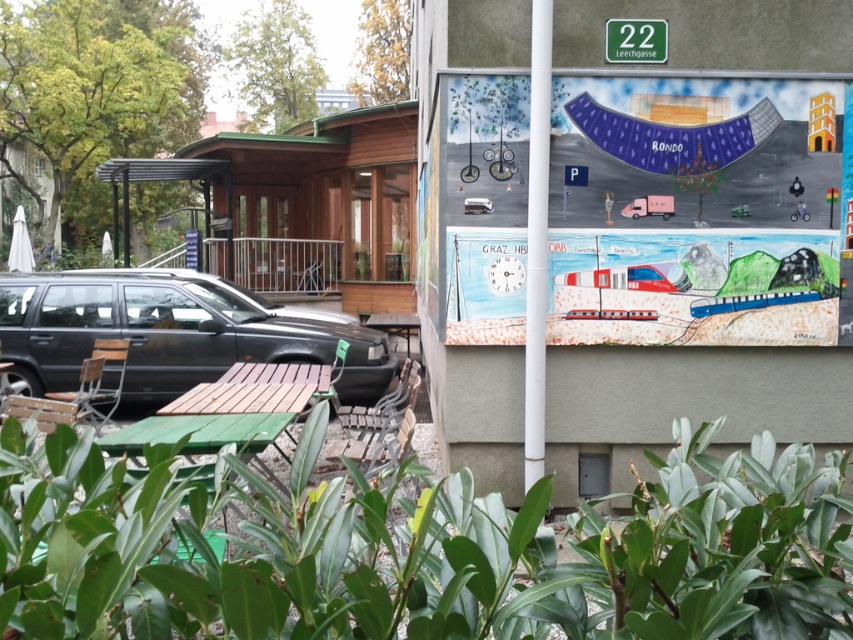
Question: Which point is farther to the camera?

Choices:
 (A) (366, 426)
 (B) (80, 301)
 (C) (462, 310)
 (D) (276, 422)

Answer: (B)

Question: Among these objects, which one is farthest from the camera?

Choices:
 (A) watercolor painting of train at upper right
 (B) green plastic street sign at upper center
 (C) matte black car at lower left
 (D) green wooden picnic table at lower left

Answer: (C)

Question: Is metallic silver bench at center below green plastic street sign at upper center?

Choices:
 (A) yes
 (B) no

Answer: (A)

Question: Does metallic silver bench at center lie in front of green plastic street sign at upper center?

Choices:
 (A) yes
 (B) no

Answer: (A)

Question: Which object is farther from the camera taking this photo?

Choices:
 (A) white smooth pole at center
 (B) matte black car at lower left

Answer: (B)

Question: Observing the image, what is the correct spatial positioning of matte black car at lower left in reference to green plastic street sign at upper center?

Choices:
 (A) above
 (B) below

Answer: (B)